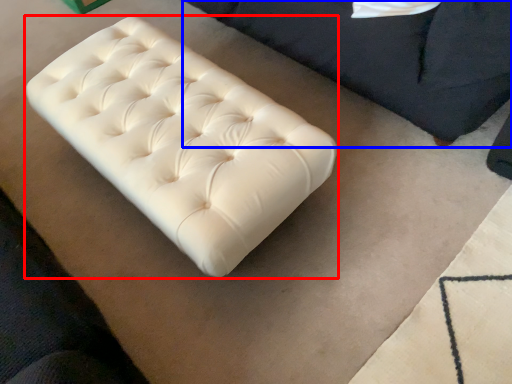
Question: Which of the following is the farthest to the observer, furniture (highlighted by a red box) or furniture (highlighted by a blue box)?

Choices:
 (A) furniture
 (B) furniture

Answer: (A)